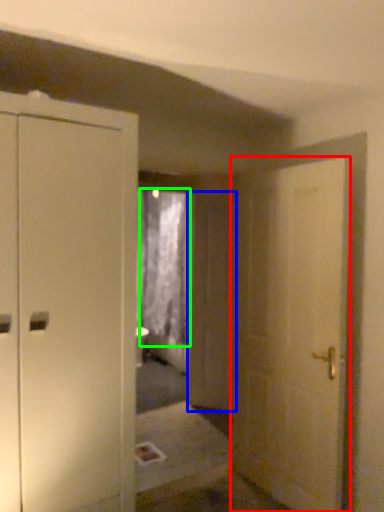
Question: Estimate the real-world distances between objects in this image. Which object is closer to door (highlighted by a red box), screen door (highlighted by a blue box) or curtain (highlighted by a green box)?

Choices:
 (A) screen door
 (B) curtain

Answer: (A)